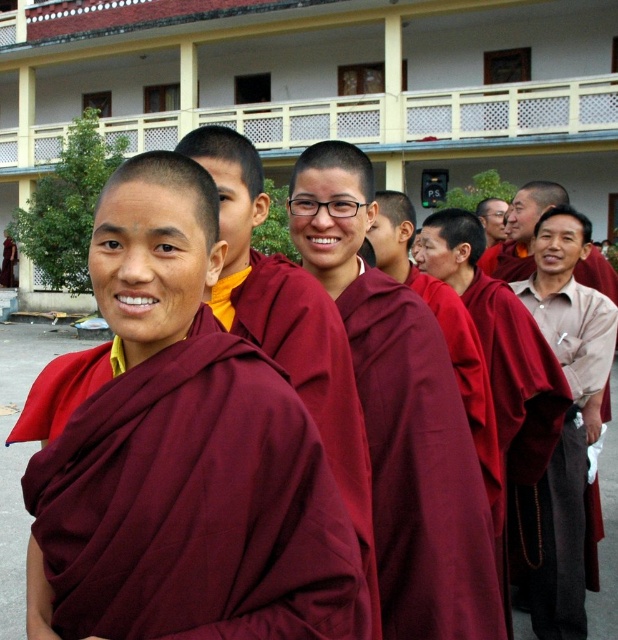
What do you see at coordinates (192, 500) in the screenshot? I see `burgundy woolen robe at center` at bounding box center [192, 500].

The height and width of the screenshot is (640, 618). Identify the location of burgundy woolen robe at center. (192, 500).

Is point (415, 422) closer to viewer compared to point (329, 442)?

No, (415, 422) is behind (329, 442).

Is maroon cloth at center thinner than maroon robe at center?

Indeed, maroon cloth at center has a lesser width compared to maroon robe at center.

Who is more distant from viewer, (480, 636) or (318, 419)?

The point (318, 419) is behind.

At what (x,y) coordinates should I click in order to perform the action: click on maroon cloth at center. Please return your answer as a coordinate pair (x, y). The width and height of the screenshot is (618, 640). Looking at the image, I should click on (420, 468).

Is burgundy woolen robe at center wider than maroon cloth at center?

Yes.

Which is below, burgundy woolen robe at center or maroon cloth at center?

burgundy woolen robe at center

What do you see at coordinates (192, 500) in the screenshot? This screenshot has height=640, width=618. I see `burgundy woolen robe at center` at bounding box center [192, 500].

Locate an element on the screen. burgundy woolen robe at center is located at coordinates (192, 500).